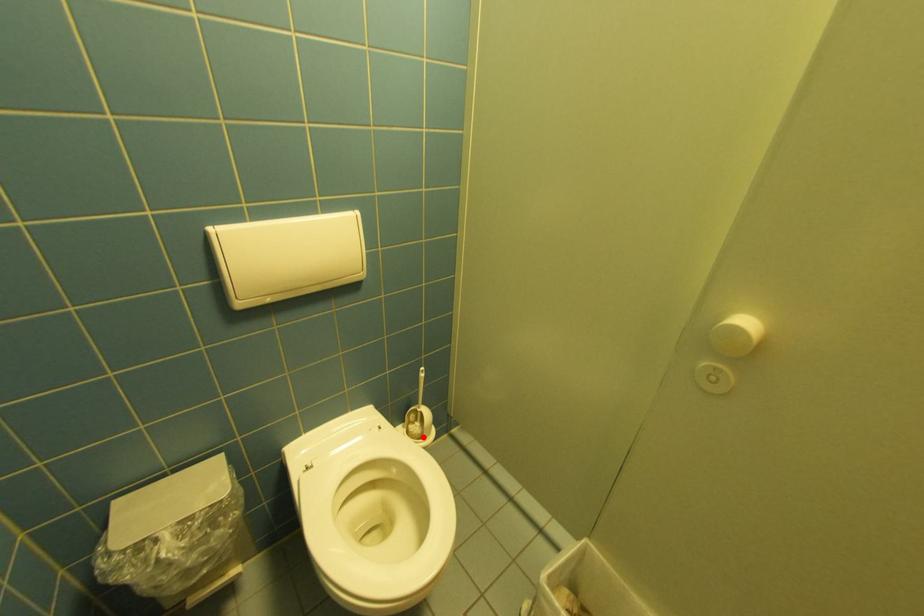
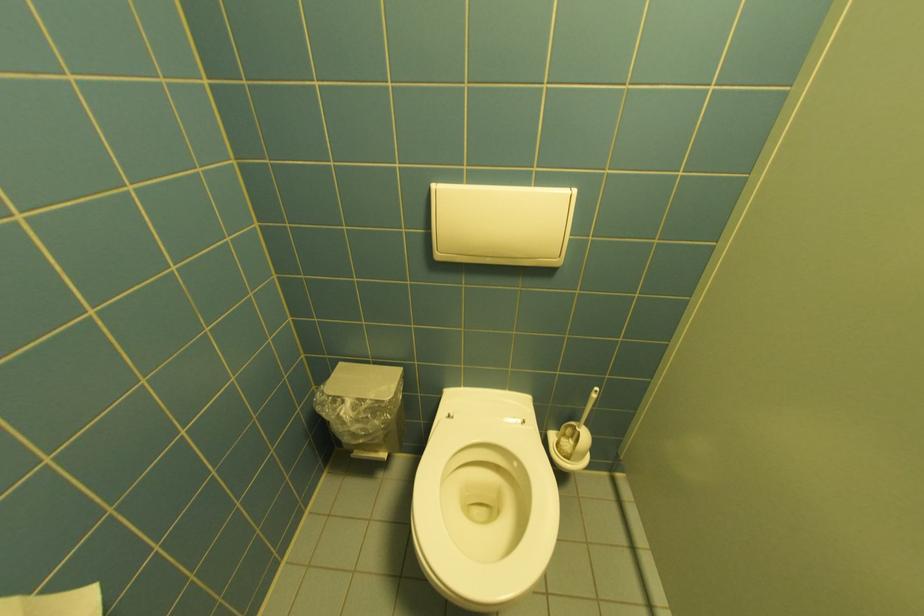
Question: I am providing you with two images of the same scene from different viewpoints. A red point is shown in image1. For the corresponding object point in image2, is it positioned nearer or farther from the camera?

Choices:
 (A) Nearer
 (B) Farther

Answer: (A)